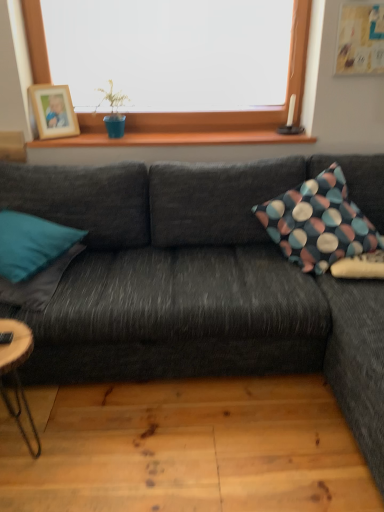
Question: Can you confirm if dark gray fabric couch at center is taller than wooden natural coffee table at lower left?

Choices:
 (A) yes
 (B) no

Answer: (A)

Question: Is dark gray fabric couch at center far from wooden natural coffee table at lower left?

Choices:
 (A) no
 (B) yes

Answer: (A)

Question: Is the position of dark gray fabric couch at center more distant than that of wooden natural coffee table at lower left?

Choices:
 (A) no
 (B) yes

Answer: (B)

Question: Can you confirm if dark gray fabric couch at center is shorter than wooden natural coffee table at lower left?

Choices:
 (A) yes
 (B) no

Answer: (B)

Question: Would you say wooden natural coffee table at lower left is part of dark gray fabric couch at center's contents?

Choices:
 (A) no
 (B) yes

Answer: (A)

Question: Considering the positions of wooden photo frame at upper left and wooden natural coffee table at lower left in the image, is wooden photo frame at upper left taller or shorter than wooden natural coffee table at lower left?

Choices:
 (A) short
 (B) tall

Answer: (A)

Question: Relative to wooden natural coffee table at lower left, is wooden photo frame at upper left in front or behind?

Choices:
 (A) front
 (B) behind

Answer: (B)

Question: Is point (46, 112) closer or farther from the camera than point (21, 344)?

Choices:
 (A) farther
 (B) closer

Answer: (A)

Question: In the image, is wooden photo frame at upper left on the left side or the right side of wooden natural coffee table at lower left?

Choices:
 (A) left
 (B) right

Answer: (A)

Question: From a real-world perspective, is dark gray fabric couch at center physically located above or below wooden photo frame at upper left?

Choices:
 (A) above
 (B) below

Answer: (B)

Question: In terms of height, does dark gray fabric couch at center look taller or shorter compared to wooden photo frame at upper left?

Choices:
 (A) tall
 (B) short

Answer: (A)

Question: Considering the positions of point (276, 315) and point (54, 118), is point (276, 315) closer or farther from the camera than point (54, 118)?

Choices:
 (A) farther
 (B) closer

Answer: (B)

Question: Relative to wooden photo frame at upper left, is dark gray fabric couch at center in front or behind?

Choices:
 (A) behind
 (B) front

Answer: (B)

Question: In the image, is teal fabric pillow at left, marked as the 3th pillow in a right-to-left arrangement, on the left side or the right side of wooden at upper center?

Choices:
 (A) left
 (B) right

Answer: (A)

Question: From a real-world perspective, relative to wooden at upper center, is teal fabric pillow at left, arranged as the 1th pillow when viewed from the left, vertically above or below?

Choices:
 (A) above
 (B) below

Answer: (B)